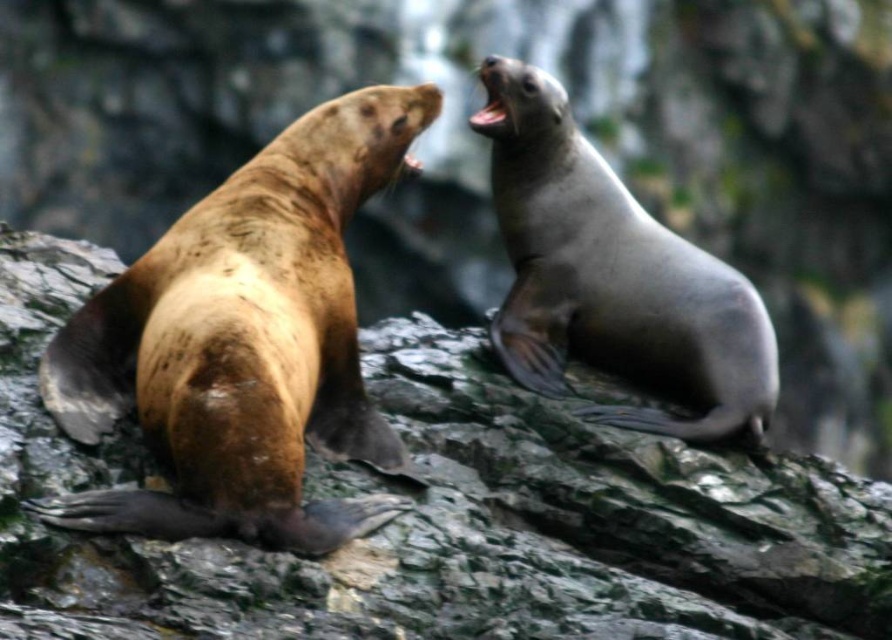
Is green rock at center shorter than brown fur seal at left?

Correct, green rock at center is not as tall as brown fur seal at left.

Between point (493, 620) and point (197, 330), which one is positioned behind?

Positioned behind is point (197, 330).

Locate an element on the screen. green rock at center is located at coordinates (442, 515).

Is point (329, 106) positioned before point (747, 308)?

That is True.

Can you confirm if brown fur seal at left is positioned below smooth gray seal at upper right?

Indeed, brown fur seal at left is positioned under smooth gray seal at upper right.

The width and height of the screenshot is (892, 640). What do you see at coordinates (244, 342) in the screenshot? I see `brown fur seal at left` at bounding box center [244, 342].

At what (x,y) coordinates should I click in order to perform the action: click on brown fur seal at left. Please return your answer as a coordinate pair (x, y). The height and width of the screenshot is (640, 892). Looking at the image, I should click on (244, 342).

Which is below, green rock at center or smooth gray seal at upper right?

green rock at center is below.

Is green rock at center below smooth gray seal at upper right?

Correct, green rock at center is located below smooth gray seal at upper right.

Find the location of a particular element. The width and height of the screenshot is (892, 640). green rock at center is located at coordinates click(442, 515).

Identify the location of green rock at center. (442, 515).